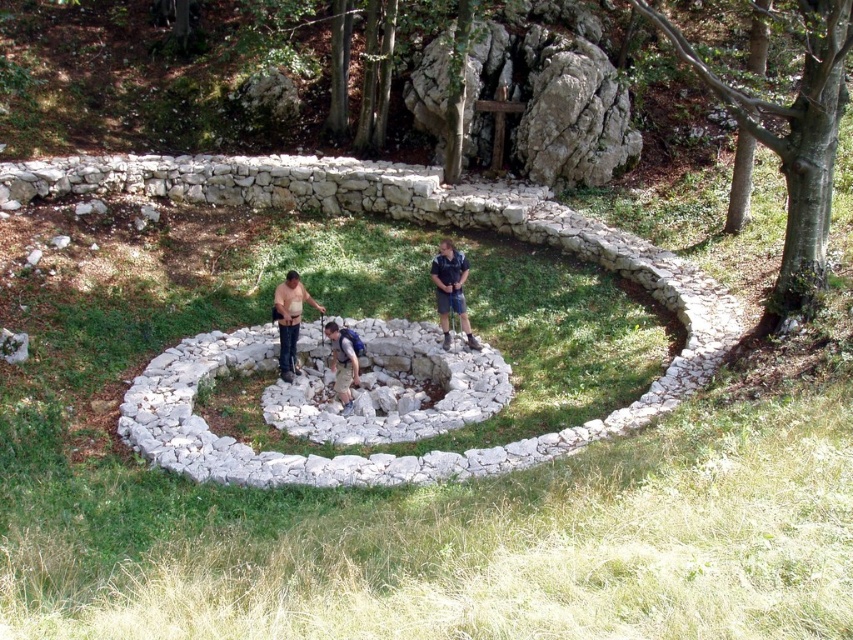
Is blue denim shirt at center positioned in front of light brown leather shirt at center?

That is False.

What do you see at coordinates (451, 291) in the screenshot?
I see `blue denim shirt at center` at bounding box center [451, 291].

Where is `blue denim shirt at center`? Image resolution: width=853 pixels, height=640 pixels. blue denim shirt at center is located at coordinates (451, 291).

Who is more forward, (451,282) or (346,406)?

Point (346,406) is in front.

Does point (447, 285) come closer to viewer compared to point (349, 372)?

No, it is not.

Identify the location of blue denim shirt at center. This screenshot has height=640, width=853. (451, 291).

Between light brown leather shirt at center and denim shorts at center, which one appears on the right side from the viewer's perspective?

Positioned to the right is denim shorts at center.

This screenshot has height=640, width=853. Identify the location of light brown leather shirt at center. (289, 321).

Does point (294, 291) come behind point (352, 372)?

Yes, point (294, 291) is farther from viewer.

At what (x,y) coordinates should I click in order to perform the action: click on light brown leather shirt at center. Please return your answer as a coordinate pair (x, y). Image resolution: width=853 pixels, height=640 pixels. Looking at the image, I should click on (289, 321).